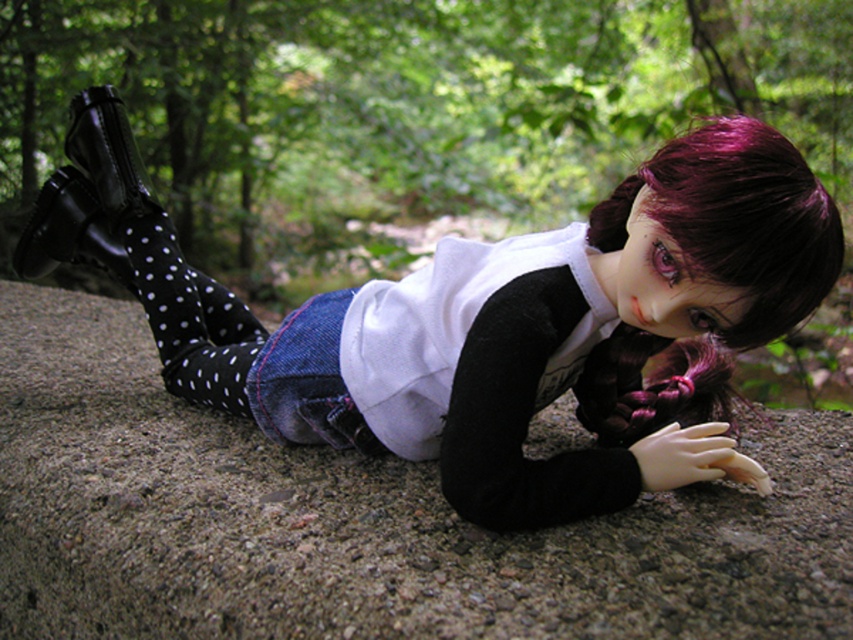
Consider the image. Between gray concrete at center and white matte shirt at center, which one appears on the left side from the viewer's perspective?

From the viewer's perspective, gray concrete at center appears more on the left side.

Looking at this image, which is more to the right, gray concrete at center or white matte shirt at center?

white matte shirt at center

Who is more forward, (26, 349) or (195, 291)?

Point (195, 291) is in front.

The height and width of the screenshot is (640, 853). What are the coordinates of `gray concrete at center` in the screenshot? It's located at (361, 522).